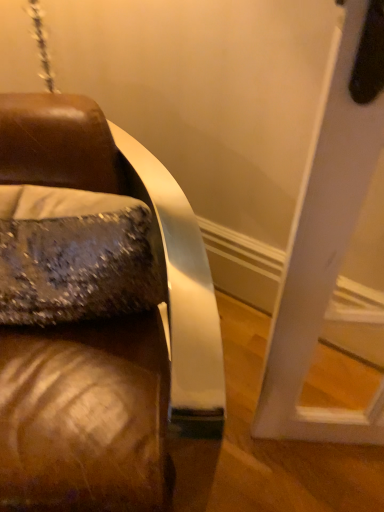
Find the location of a particular element. brown leather couch at left is located at coordinates (104, 335).

In order to face brown leather couch at left, should I rotate leftwards or rightwards?

A 18.574 degree turn to the left will do.

This screenshot has height=512, width=384. Describe the element at coordinates (104, 335) in the screenshot. I see `brown leather couch at left` at that location.

This screenshot has width=384, height=512. What do you see at coordinates (73, 256) in the screenshot? I see `sparkly silver pillow at left` at bounding box center [73, 256].

What is the approximate width of sparkly silver pillow at left?

The width of sparkly silver pillow at left is 8.83 inches.

What is the approximate height of sparkly silver pillow at left?

12.01 inches.

Image resolution: width=384 pixels, height=512 pixels. Identify the location of sparkly silver pillow at left. (73, 256).

Identify the location of brown leather couch at left. (104, 335).

Which is more to the right, sparkly silver pillow at left or brown leather couch at left?

From the viewer's perspective, sparkly silver pillow at left appears more on the right side.

Is the depth of sparkly silver pillow at left greater than that of brown leather couch at left?

Yes, sparkly silver pillow at left is further from the viewer.

Does point (102, 242) appear closer or farther from the camera than point (56, 411)?

Point (102, 242) is positioned farther from the camera compared to point (56, 411).

From the image's perspective, who appears lower, sparkly silver pillow at left or brown leather couch at left?

brown leather couch at left appears lower in the image.

From a real-world perspective, is sparkly silver pillow at left physically located above or below brown leather couch at left?

From a real-world perspective, sparkly silver pillow at left is physically above brown leather couch at left.

Considering the sizes of objects sparkly silver pillow at left and brown leather couch at left in the image provided, who is thinner, sparkly silver pillow at left or brown leather couch at left?

Thinner between the two is sparkly silver pillow at left.

In terms of height, does sparkly silver pillow at left look taller or shorter compared to brown leather couch at left?

In the image, sparkly silver pillow at left appears to be shorter than brown leather couch at left.

Who is smaller, sparkly silver pillow at left or brown leather couch at left?

Smaller between the two is sparkly silver pillow at left.

Would you say sparkly silver pillow at left is outside brown leather couch at left?

That's incorrect, sparkly silver pillow at left is not completely outside brown leather couch at left.

Is there a large distance between sparkly silver pillow at left and brown leather couch at left?

sparkly silver pillow at left is near brown leather couch at left, not far away.

Is sparkly silver pillow at left facing away from brown leather couch at left?

Result: Yes.

Can you tell me how much sparkly silver pillow at left and brown leather couch at left differ in facing direction?

They differ by 1.62 degrees in their facing directions.

Measure the distance from sparkly silver pillow at left to brown leather couch at left.

They are 30.55 inches apart.

Locate an element on the screen. furniture on the left side of sparkly silver pillow at left is located at coordinates (104, 335).

Between brown leather couch at left and sparkly silver pillow at left, which one appears on the left side from the viewer's perspective?

Positioned to the left is brown leather couch at left.

Which object is further away from the camera, brown leather couch at left or sparkly silver pillow at left?

sparkly silver pillow at left is further away from the camera.

Does point (165, 179) appear closer or farther from the camera than point (56, 302)?

Point (165, 179) is positioned farther from the camera compared to point (56, 302).

From the image's perspective, is brown leather couch at left located above or below sparkly silver pillow at left?

From the image's perspective, brown leather couch at left appears below sparkly silver pillow at left.

From a real-world perspective, is brown leather couch at left physically below sparkly silver pillow at left?

Indeed, from a real-world perspective, brown leather couch at left is positioned beneath sparkly silver pillow at left.

Considering the sizes of brown leather couch at left and sparkly silver pillow at left in the image, is brown leather couch at left wider or thinner than sparkly silver pillow at left?

In the image, brown leather couch at left appears to be wider than sparkly silver pillow at left.

Can you confirm if brown leather couch at left is taller than sparkly silver pillow at left?

Yes, brown leather couch at left is taller than sparkly silver pillow at left.

Who is smaller, brown leather couch at left or sparkly silver pillow at left?

sparkly silver pillow at left is smaller.

Based on the photo, is brown leather couch at left inside or outside of sparkly silver pillow at left?

brown leather couch at left cannot be found inside sparkly silver pillow at left.

Is the surface of brown leather couch at left in direct contact with sparkly silver pillow at left?

brown leather couch at left is not next to sparkly silver pillow at left, and they're not touching.

Does brown leather couch at left turn towards sparkly silver pillow at left?

Yes.

Measure the distance from brown leather couch at left to sparkly silver pillow at left.

brown leather couch at left and sparkly silver pillow at left are 30.55 inches apart.

Where is `throw pillow above the brown leather couch at left (from the image's perspective)`? throw pillow above the brown leather couch at left (from the image's perspective) is located at coordinates (73, 256).

The height and width of the screenshot is (512, 384). In order to click on furniture in front of the sparkly silver pillow at left in this screenshot , I will do (104, 335).

Locate an element on the screen. This screenshot has width=384, height=512. furniture directly beneath the sparkly silver pillow at left (from a real-world perspective) is located at coordinates (104, 335).